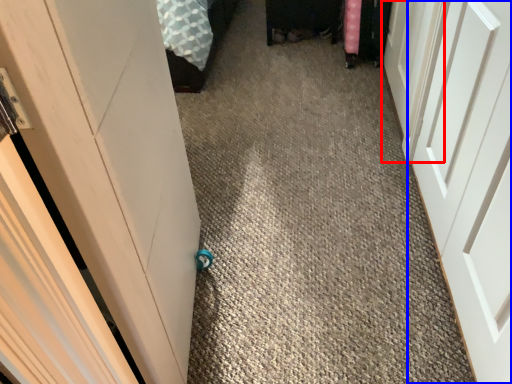
Question: Which object appears closest to the camera in this image, door (highlighted by a red box) or door (highlighted by a blue box)?

Choices:
 (A) door
 (B) door

Answer: (B)